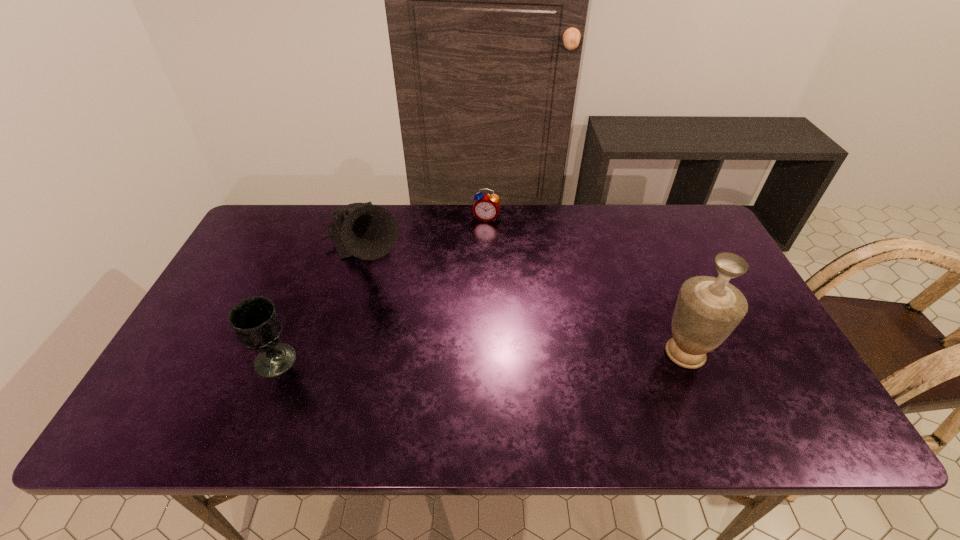
Where is `vacant area that lies between the rightmost object and the phonograph_record`? vacant area that lies between the rightmost object and the phonograph_record is located at coordinates pyautogui.click(x=525, y=302).

The image size is (960, 540). Find the location of `free point between the third shortest object and the third tallest object`. free point between the third shortest object and the third tallest object is located at coordinates (321, 306).

This screenshot has height=540, width=960. What are the coordinates of `free spot between the shortest object and the phonograph_record` in the screenshot? It's located at (425, 235).

I want to click on the third closest object to the rightmost object, so (x=255, y=321).

Where is `object that stands as the second closest to the second shortest object`? object that stands as the second closest to the second shortest object is located at coordinates (486, 207).

The width and height of the screenshot is (960, 540). What are the coordinates of `vacant space that satisfies the following two spatial constraints: 1. on the front side of the urn; 2. on the left side of the second tallest object` in the screenshot? It's located at coord(335,354).

Where is `free space in the image that satisfies the following two spatial constraints: 1. on the front side of the rightmost object; 2. on the right side of the second tallest object`? This screenshot has width=960, height=540. free space in the image that satisfies the following two spatial constraints: 1. on the front side of the rightmost object; 2. on the right side of the second tallest object is located at coordinates (335, 354).

Where is `free space in the image that satisfies the following two spatial constraints: 1. on the back side of the phonograph_record; 2. on the right side of the chalice`? This screenshot has width=960, height=540. free space in the image that satisfies the following two spatial constraints: 1. on the back side of the phonograph_record; 2. on the right side of the chalice is located at coordinates (320, 252).

Where is `free space that satisfies the following two spatial constraints: 1. on the front side of the second object from right to left; 2. on the left side of the rightmost object`? The image size is (960, 540). free space that satisfies the following two spatial constraints: 1. on the front side of the second object from right to left; 2. on the left side of the rightmost object is located at coordinates (489, 354).

This screenshot has height=540, width=960. In order to click on vacant position in the image that satisfies the following two spatial constraints: 1. on the front side of the phonograph_record; 2. on the right side of the urn in this screenshot , I will do `click(335, 354)`.